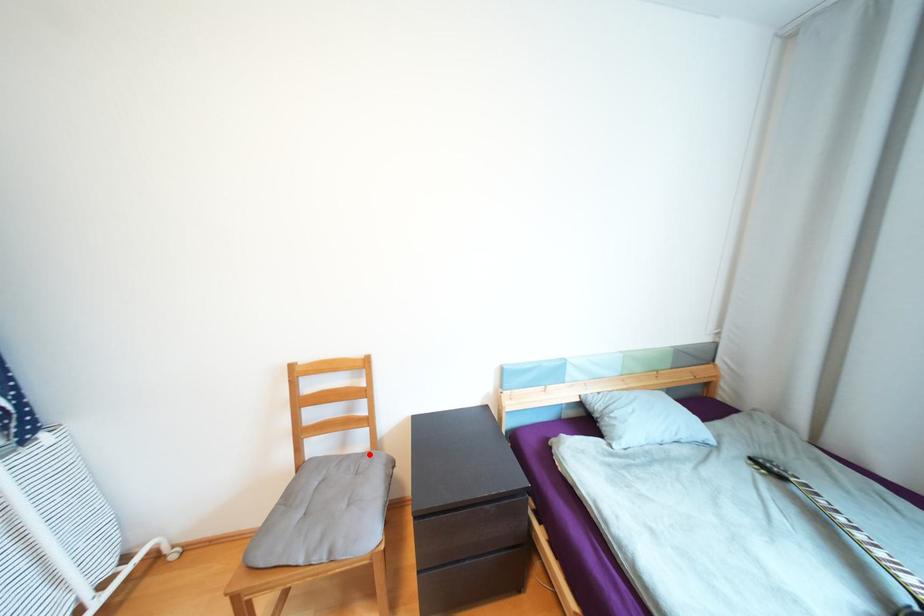
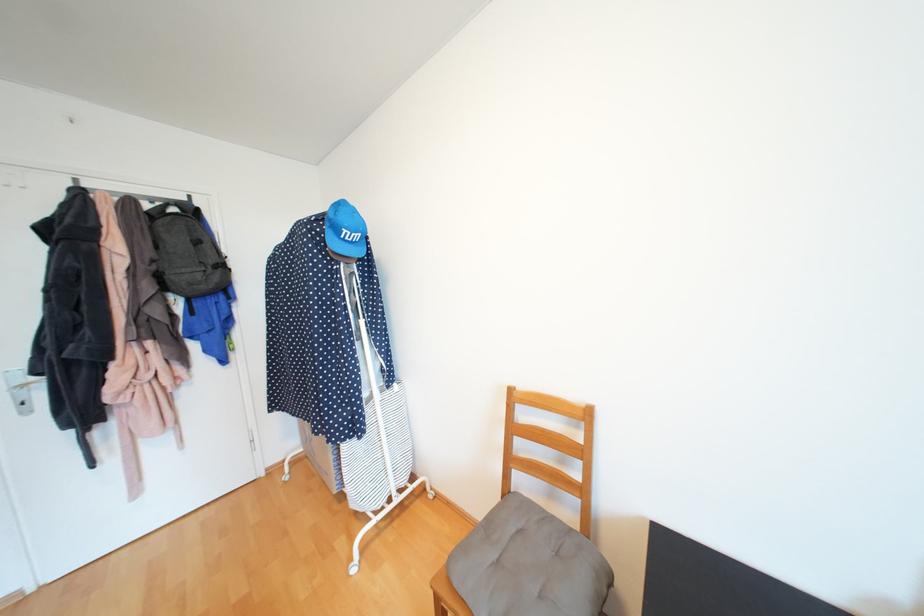
Question: A red point is marked in image1. In image2, is the corresponding 3D point closer to the camera or farther? Reply with the corresponding letter.

Choices:
 (A) The corresponding 3D point is closer.
 (B) The corresponding 3D point is farther.

Answer: (B)